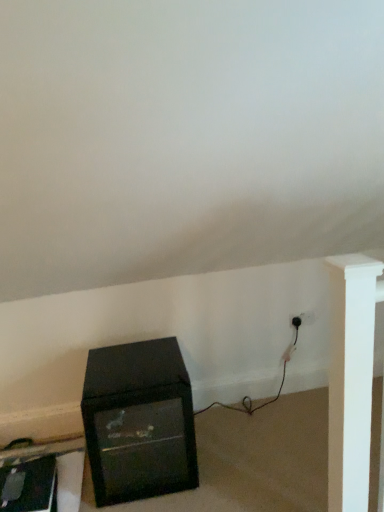
Question: Is black glossy tv at lower left, which appears as the second furniture when viewed from the right, smaller than black plastic plug at lower right?

Choices:
 (A) yes
 (B) no

Answer: (B)

Question: Considering the relative positions of black glossy tv at lower left, acting as the first furniture starting from the left, and black plastic plug at lower right in the image provided, is black glossy tv at lower left, acting as the first furniture starting from the left, to the left of black plastic plug at lower right from the viewer's perspective?

Choices:
 (A) no
 (B) yes

Answer: (B)

Question: Would you say black plastic plug at lower right is part of black glossy tv at lower left, acting as the first furniture starting from the left,'s contents?

Choices:
 (A) yes
 (B) no

Answer: (B)

Question: From a real-world perspective, does black glossy tv at lower left, acting as the first furniture starting from the left, stand above black plastic plug at lower right?

Choices:
 (A) no
 (B) yes

Answer: (A)

Question: Is black glossy tv at lower left, which appears as the second furniture when viewed from the right, shorter than black plastic plug at lower right?

Choices:
 (A) no
 (B) yes

Answer: (A)

Question: Is black glossy tv at lower left, acting as the first furniture starting from the left, located outside black plastic plug at lower right?

Choices:
 (A) yes
 (B) no

Answer: (A)

Question: Is black plastic plug at lower right at the left side of black matte cabinet at lower left, which is the 2th furniture in left-to-right order?

Choices:
 (A) no
 (B) yes

Answer: (A)

Question: Is black plastic plug at lower right thinner than black matte cabinet at lower left, which appears as the 1th furniture when viewed from the right?

Choices:
 (A) no
 (B) yes

Answer: (B)

Question: Is black plastic plug at lower right to the right of black matte cabinet at lower left, which is the 2th furniture in left-to-right order, from the viewer's perspective?

Choices:
 (A) no
 (B) yes

Answer: (B)

Question: From a real-world perspective, is black plastic plug at lower right located beneath black matte cabinet at lower left, which appears as the 1th furniture when viewed from the right?

Choices:
 (A) no
 (B) yes

Answer: (A)

Question: From the image's perspective, is black plastic plug at lower right under black matte cabinet at lower left, which is the 2th furniture in left-to-right order?

Choices:
 (A) yes
 (B) no

Answer: (B)

Question: Is black plastic plug at lower right not near black matte cabinet at lower left, which appears as the 1th furniture when viewed from the right?

Choices:
 (A) yes
 (B) no

Answer: (A)

Question: Does black plastic plug at lower right have a greater width compared to black glossy tv at lower left, which appears as the second furniture when viewed from the right?

Choices:
 (A) no
 (B) yes

Answer: (A)